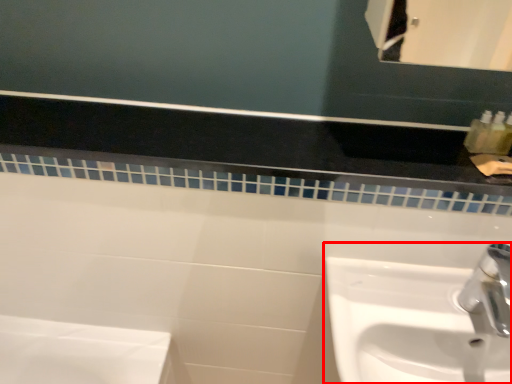
Question: From the image's perspective, considering the relative positions of sink (annotated by the red box) and balustrade in the image provided, where is sink (annotated by the red box) located with respect to the staircase?

Choices:
 (A) above
 (B) below

Answer: (B)